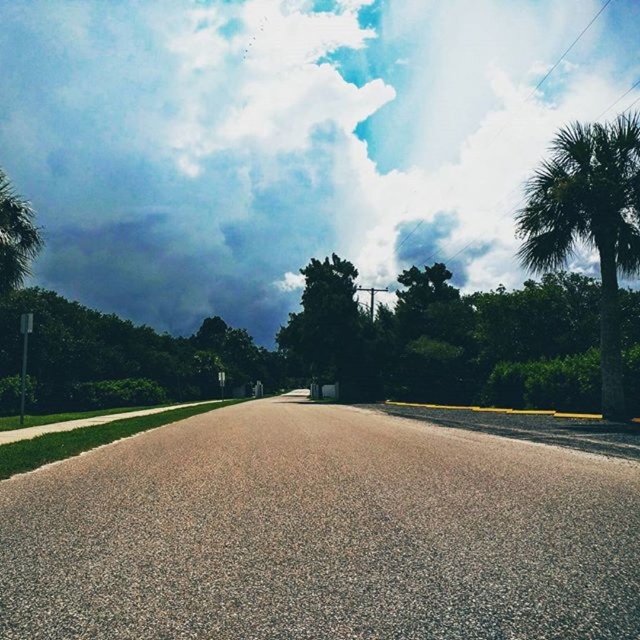
Can you confirm if green leafy palm tree at right is positioned above green leafy tree at center?

Yes.

Can you confirm if green leafy palm tree at right is thinner than green leafy tree at center?

No.

Is point (611, 369) more distant than point (349, 317)?

No, (611, 369) is closer to viewer.

Find the location of a particular element. green leafy palm tree at right is located at coordinates (589, 224).

Which of these two, cloudy sky at upper center or green leafy palm tree at right, stands taller?

cloudy sky at upper center is taller.

Between point (60, 145) and point (609, 324), which one is positioned in front?

Point (609, 324)

Is point (483, 132) in front of point (624, 236)?

No.

The width and height of the screenshot is (640, 640). What are the coordinates of `cloudy sky at upper center` in the screenshot? It's located at point(289,138).

Consider the image. Which of these two, cloudy sky at upper center or green leafy tree at center, stands shorter?

green leafy tree at center

Who is lower down, cloudy sky at upper center or green leafy tree at center?

green leafy tree at center

Which is behind, point (51, 58) or point (365, 324)?

The point (51, 58) is behind.

Find the location of a particular element. The image size is (640, 640). cloudy sky at upper center is located at coordinates (289, 138).